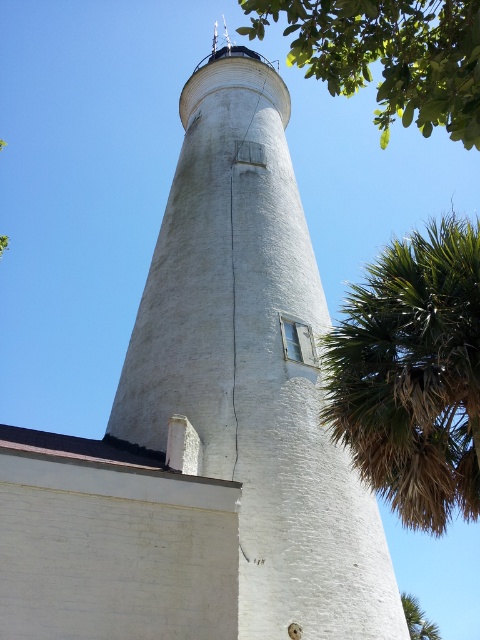
Does brown leafy palm tree at right have a lesser width compared to green leafy tree at upper right?

No.

Between point (398, 323) and point (387, 116), which one is positioned behind?

Point (387, 116)

The height and width of the screenshot is (640, 480). Identify the location of brown leafy palm tree at right. tap(412, 374).

What do you see at coordinates (253, 365) in the screenshot? This screenshot has height=640, width=480. I see `white textured tower at center` at bounding box center [253, 365].

Is white textured tower at center above green leafy tree at upper right?

Incorrect, white textured tower at center is not positioned above green leafy tree at upper right.

Locate an element on the screen. white textured tower at center is located at coordinates (253, 365).

Locate an element on the screen. The width and height of the screenshot is (480, 640). white textured tower at center is located at coordinates (253, 365).

Between point (218, 109) and point (419, 609), which one is positioned in front?

Point (218, 109) is more forward.

Between point (259, 429) and point (421, 637), which one is positioned behind?

Point (421, 637)

Which is behind, point (117, 419) or point (408, 616)?

The point (408, 616) is behind.

I want to click on white textured tower at center, so click(x=253, y=365).